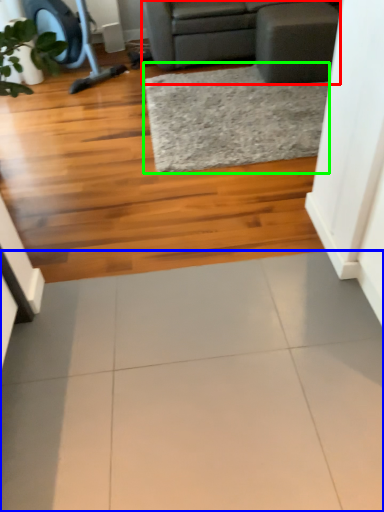
Question: Based on their relative distances, which object is farther from studio couch (highlighted by a red box)? Choose from ceramic tile (highlighted by a blue box) and mat (highlighted by a green box).

Choices:
 (A) ceramic tile
 (B) mat

Answer: (A)